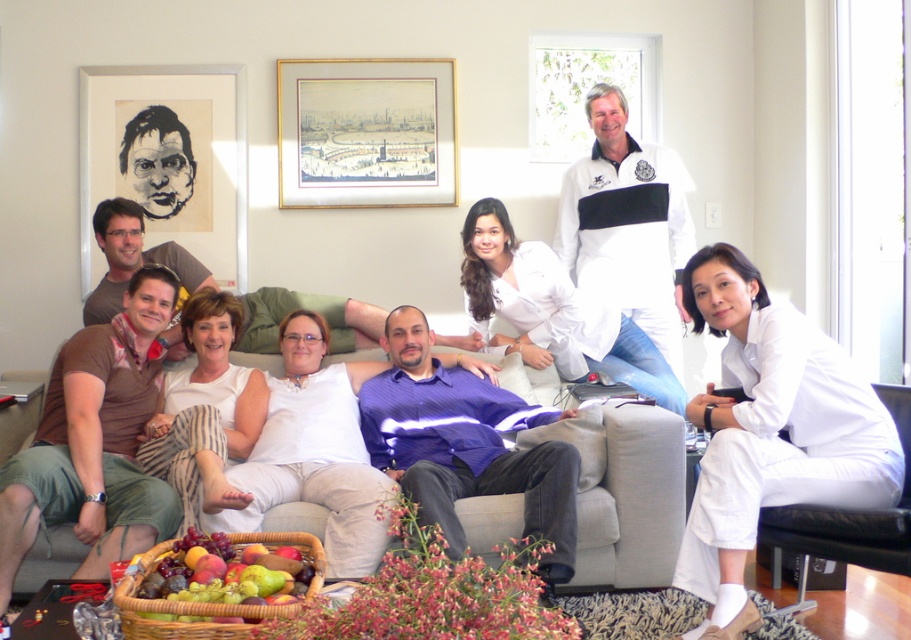
Question: Which point appears farthest from the camera in this image?

Choices:
 (A) (x=412, y=413)
 (B) (x=589, y=296)

Answer: (B)

Question: Does gold-framed picture at upper center appear over black paper portrait at upper left?

Choices:
 (A) yes
 (B) no

Answer: (A)

Question: Does purple striped shirt at center appear on the right side of gray fabric couch at center?

Choices:
 (A) yes
 (B) no

Answer: (B)

Question: Based on their relative distances, which object is nearer to the gray fabric couch at center?

Choices:
 (A) multicolored woven basket of fruits at lower left
 (B) white cotton pants at center

Answer: (B)

Question: Which is nearer to the gold-framed picture at upper center?

Choices:
 (A) black paper portrait at upper left
 (B) multicolored woven basket of fruits at lower left
 (C) matte brown shirt at center
 (D) gray fabric couch at center

Answer: (A)

Question: Is purple striped shirt at center bigger than matte brown shirt at center?

Choices:
 (A) no
 (B) yes

Answer: (B)